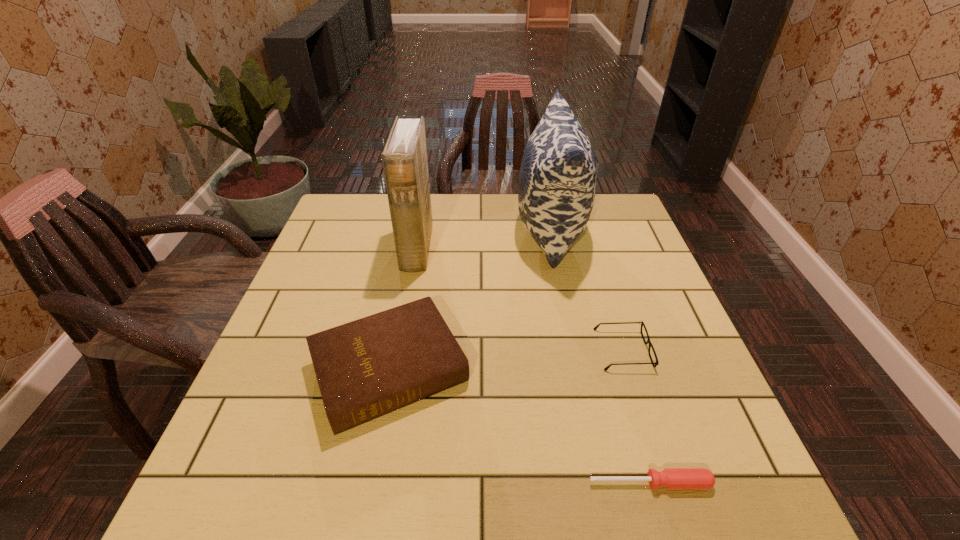
The width and height of the screenshot is (960, 540). In order to click on free area in between the screwdriver and the Bible in this screenshot , I will do `click(520, 426)`.

Image resolution: width=960 pixels, height=540 pixels. What are the coordinates of `free space between the cushion and the spectacles` in the screenshot? It's located at (587, 290).

Locate an element on the screen. The height and width of the screenshot is (540, 960). free space between the nearest object and the phonebook is located at coordinates (534, 366).

Identify the location of free space between the Bible and the screwdriver. (520, 426).

This screenshot has width=960, height=540. Identify the location of free space between the Bible and the cushion. (470, 300).

Locate an element on the screen. This screenshot has width=960, height=540. vacant area that lies between the phonebook and the cushion is located at coordinates point(484,239).

Where is `object that is the second closest one to the spectacles`? The width and height of the screenshot is (960, 540). object that is the second closest one to the spectacles is located at coordinates (670, 478).

The height and width of the screenshot is (540, 960). What are the coordinates of `object that ranks as the fourth closest to the spectacles` in the screenshot? It's located at (404, 158).

Image resolution: width=960 pixels, height=540 pixels. What are the coordinates of `free location that satisfies the following two spatial constraints: 1. on the cover of the screwdriver; 2. on the right side of the phonebook` in the screenshot? It's located at (375, 483).

The image size is (960, 540). In order to click on vacant region that satisfies the following two spatial constraints: 1. on the back side of the screwdriver; 2. on the front surface of the cushion in this screenshot , I will do `click(578, 231)`.